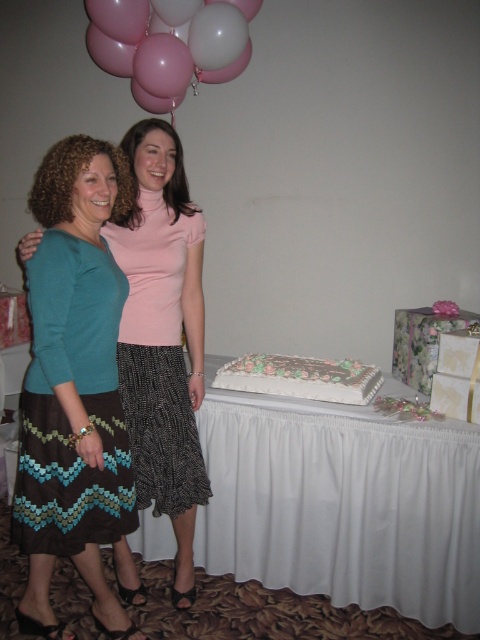
Is teal fabric skirt at left closer to the viewer compared to white matte balloon at upper center?

Yes, it is.

Who is taller, teal fabric skirt at left or white matte balloon at upper center?

With more height is teal fabric skirt at left.

Is point (122, 404) in front of point (230, 29)?

Yes, it is.

The width and height of the screenshot is (480, 640). I want to click on teal fabric skirt at left, so click(x=163, y=336).

Is white frosted cake at lower center taller than white matte balloon at upper center?

No.

Is white frosted cake at lower center bigger than white matte balloon at upper center?

Correct, white frosted cake at lower center is larger in size than white matte balloon at upper center.

Locate an element on the screen. The width and height of the screenshot is (480, 640). white frosted cake at lower center is located at coordinates (300, 378).

Where is `white frosted cake at lower center`? white frosted cake at lower center is located at coordinates (300, 378).

From the picture: Which of these two, teal fabric skirt at left or pink glossy balloons at upper left, stands shorter?

pink glossy balloons at upper left is shorter.

Between point (142, 314) and point (145, 29), which one is positioned in front?

Positioned in front is point (142, 314).

Between point (144, 182) and point (166, 96), which one is positioned behind?

The point (166, 96) is more distant.

Locate an element on the screen. The height and width of the screenshot is (640, 480). teal fabric skirt at left is located at coordinates (163, 336).